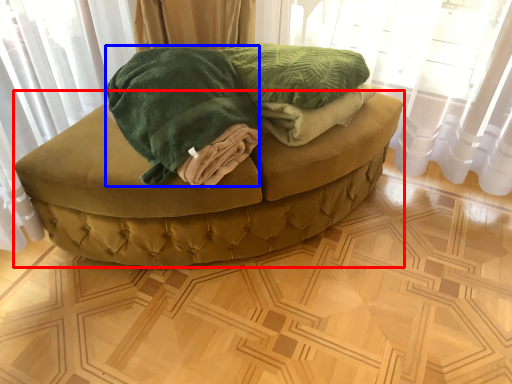
Question: Which object appears farthest to the camera in this image, furniture (highlighted by a red box) or cloth (highlighted by a blue box)?

Choices:
 (A) furniture
 (B) cloth

Answer: (A)